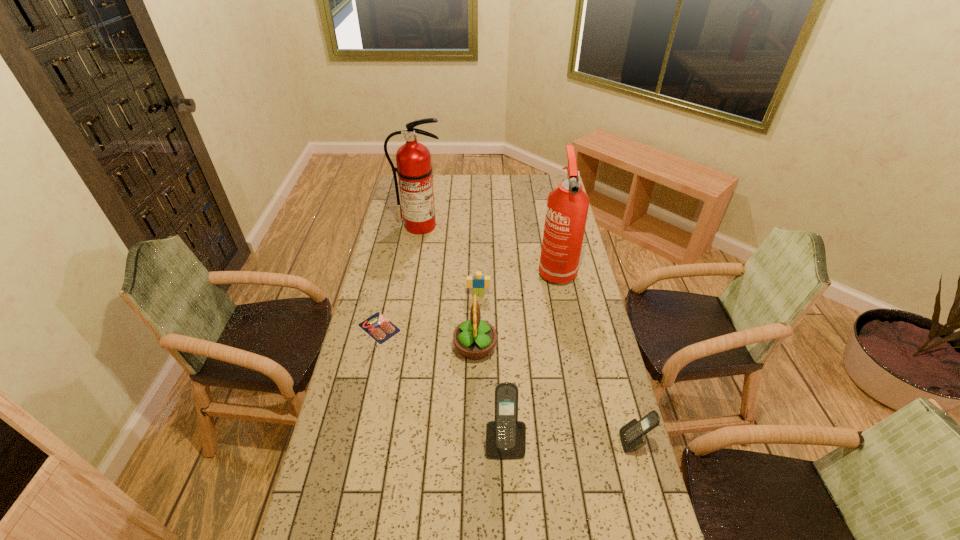
The height and width of the screenshot is (540, 960). Find the location of `fire extinguisher that is at the left edge`. fire extinguisher that is at the left edge is located at coordinates (414, 169).

Where is `salami that is positioned at the left edge`? Image resolution: width=960 pixels, height=540 pixels. salami that is positioned at the left edge is located at coordinates (377, 326).

Where is `cellular telephone situated at the right edge`? The image size is (960, 540). cellular telephone situated at the right edge is located at coordinates (632, 435).

Where is `fire extinguisher located in the right edge section of the desktop`? The height and width of the screenshot is (540, 960). fire extinguisher located in the right edge section of the desktop is located at coordinates (567, 207).

Where is `free space at the far edge of the desktop`? Image resolution: width=960 pixels, height=540 pixels. free space at the far edge of the desktop is located at coordinates (498, 183).

In the image, there is a desktop. At what (x,y) coordinates should I click in order to perform the action: click on vacant space at the left edge. Please return your answer as a coordinate pair (x, y). Looking at the image, I should click on (409, 272).

In the image, there is a desktop. Identify the location of vacant region at the right edge. (612, 417).

Locate an element on the screen. The height and width of the screenshot is (540, 960). vacant space at the near left corner is located at coordinates (307, 524).

Find the location of a particular element. The image size is (960, 540). blank region between the nearer fire extinguisher and the farthest object is located at coordinates (488, 247).

At what (x,y) coordinates should I click in order to perform the action: click on blank region between the right cellular telephone and the left fire extinguisher. Please return your answer as a coordinate pair (x, y). Looking at the image, I should click on (527, 334).